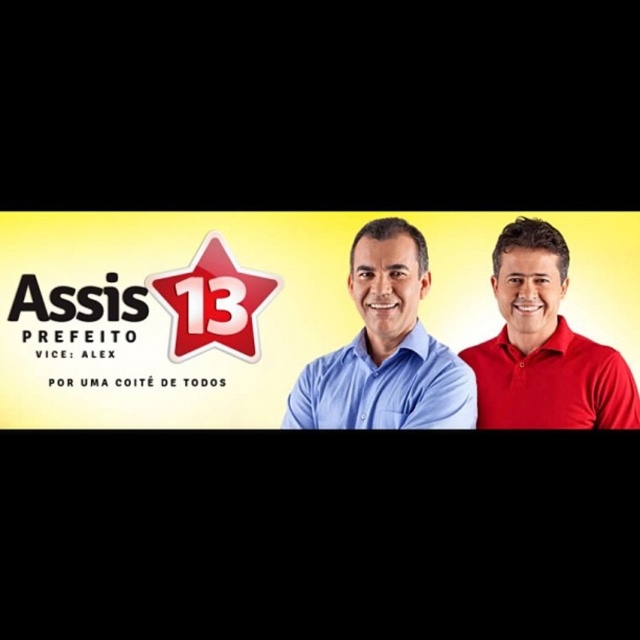
Does point (300, 392) lie in front of point (256, 340)?

Yes, it is in front of point (256, 340).

What do you see at coordinates (385, 348) in the screenshot?
I see `blue shirt at center` at bounding box center [385, 348].

Find the location of a particular element. The image size is (640, 640). blue shirt at center is located at coordinates (385, 348).

How much distance is there between blue shirt at center and red smooth polo shirt at right?

blue shirt at center and red smooth polo shirt at right are 16.76 inches apart from each other.

Who is taller, blue shirt at center or red smooth polo shirt at right?

Standing taller between the two is red smooth polo shirt at right.

The width and height of the screenshot is (640, 640). Describe the element at coordinates (385, 348) in the screenshot. I see `blue shirt at center` at that location.

The image size is (640, 640). What are the coordinates of `blue shirt at center` in the screenshot? It's located at [x=385, y=348].

Is red smooth polo shirt at right wider than matte red star at center?

Correct, the width of red smooth polo shirt at right exceeds that of matte red star at center.

Which of these two, red smooth polo shirt at right or matte red star at center, stands shorter?

matte red star at center is shorter.

Locate an element on the screen. red smooth polo shirt at right is located at coordinates (545, 346).